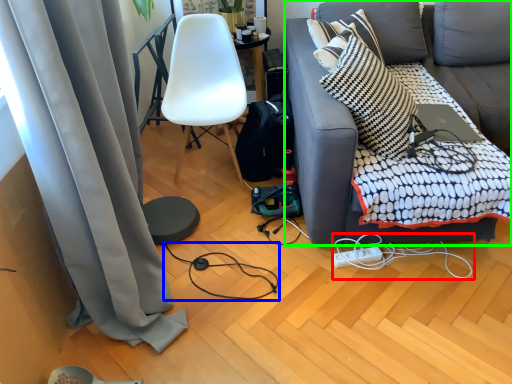
Question: Which object is the farthest from string (highlighted by a red box)? Choose among these: wire (highlighted by a blue box) or studio couch (highlighted by a green box).

Choices:
 (A) wire
 (B) studio couch

Answer: (A)